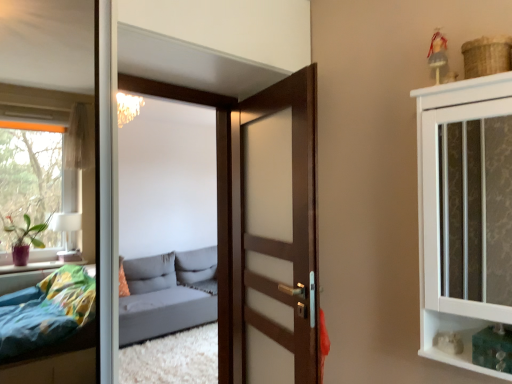
Question: From the image's perspective, would you say white textured cabinet at upper right is positioned over wooden door at center?

Choices:
 (A) yes
 (B) no

Answer: (A)

Question: Is white textured cabinet at upper right behind wooden door at center?

Choices:
 (A) no
 (B) yes

Answer: (A)

Question: From the image's perspective, is white textured cabinet at upper right under wooden door at center?

Choices:
 (A) no
 (B) yes

Answer: (A)

Question: Can you confirm if white textured cabinet at upper right is thinner than wooden door at center?

Choices:
 (A) no
 (B) yes

Answer: (A)

Question: Considering the relative sizes of white textured cabinet at upper right and wooden door at center in the image provided, is white textured cabinet at upper right shorter than wooden door at center?

Choices:
 (A) no
 (B) yes

Answer: (B)

Question: Is white textured cabinet at upper right turned away from wooden door at center?

Choices:
 (A) yes
 (B) no

Answer: (B)

Question: Is gray fabric studio couch at center oriented away from wooden door at center?

Choices:
 (A) no
 (B) yes

Answer: (A)

Question: Is gray fabric studio couch at center not inside wooden door at center?

Choices:
 (A) no
 (B) yes

Answer: (B)

Question: Is gray fabric studio couch at center positioned behind wooden door at center?

Choices:
 (A) no
 (B) yes

Answer: (B)

Question: Could you tell me if gray fabric studio couch at center is facing wooden door at center?

Choices:
 (A) no
 (B) yes

Answer: (B)

Question: Considering the relative sizes of gray fabric studio couch at center and wooden door at center in the image provided, is gray fabric studio couch at center bigger than wooden door at center?

Choices:
 (A) yes
 (B) no

Answer: (A)

Question: Is wooden door at center located within gray fabric studio couch at center?

Choices:
 (A) no
 (B) yes

Answer: (A)

Question: Does wooden door at center lie in front of white textured cabinet at upper right?

Choices:
 (A) no
 (B) yes

Answer: (A)